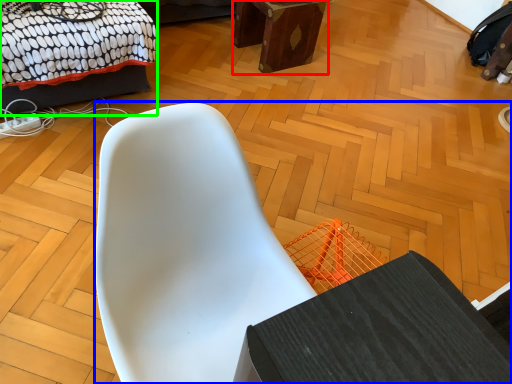
Question: Considering the real-world distances, which object is farthest from furniture (highlighted by a red box)? chair (highlighted by a blue box) or bed (highlighted by a green box)?

Choices:
 (A) chair
 (B) bed

Answer: (A)